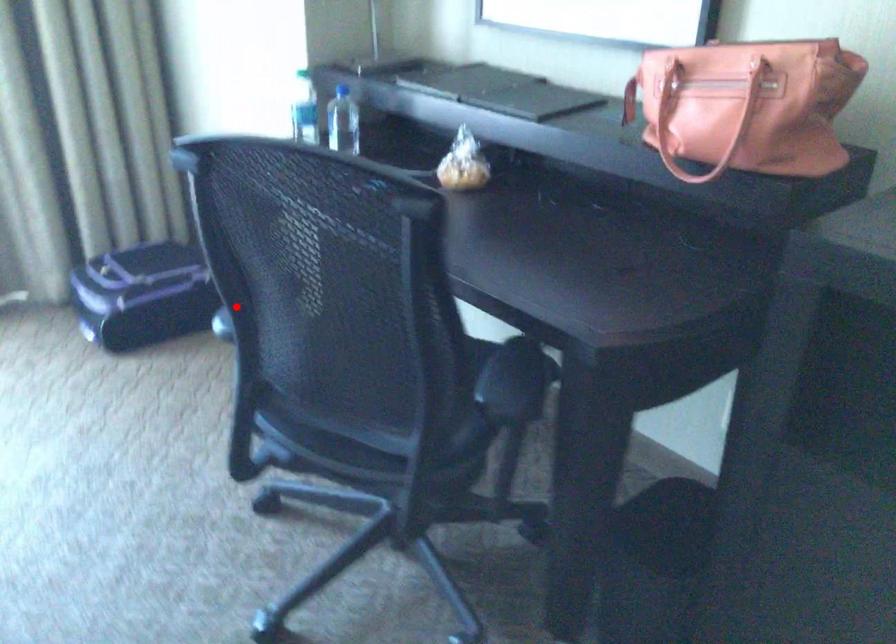
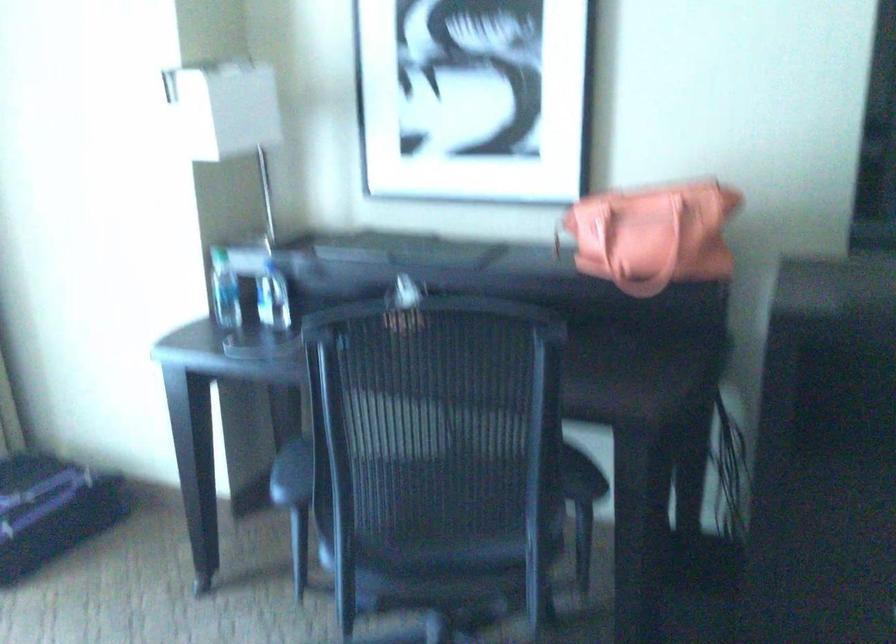
Find the pixel in the second image that matches the highlighted location in the first image.

(291, 474)